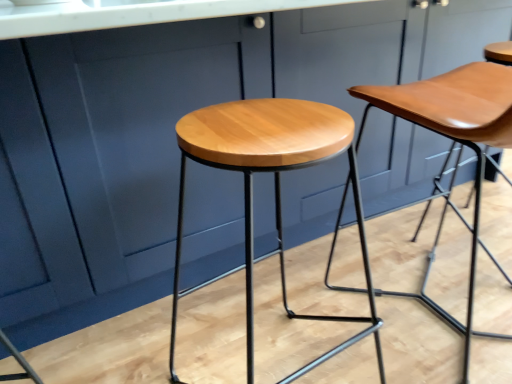
Question: In terms of height, does light brown wood stool at center, which is counted as the second stool, starting from the right, look taller or shorter compared to matte wood stool at center, the first stool viewed from the right?

Choices:
 (A) tall
 (B) short

Answer: (B)

Question: In the image, is light brown wood stool at center, which is counted as the second stool, starting from the right, positioned in front of or behind matte wood stool at center, which is counted as the 2th stool, starting from the left?

Choices:
 (A) front
 (B) behind

Answer: (A)

Question: From the image's perspective, is light brown wood stool at center, which is counted as the second stool, starting from the right, above or below matte wood stool at center, which is counted as the 2th stool, starting from the left?

Choices:
 (A) above
 (B) below

Answer: (B)

Question: Considering the positions of point (448, 81) and point (248, 369), is point (448, 81) closer or farther from the camera than point (248, 369)?

Choices:
 (A) farther
 (B) closer

Answer: (A)

Question: From a real-world perspective, is matte wood stool at center, the first stool viewed from the right, physically located above or below light brown wood stool at center, which is the first stool from left to right?

Choices:
 (A) below
 (B) above

Answer: (B)

Question: Relative to light brown wood stool at center, which is the first stool from left to right, is matte wood stool at center, which is counted as the 2th stool, starting from the left, in front or behind?

Choices:
 (A) front
 (B) behind

Answer: (B)

Question: From the image's perspective, is matte wood stool at center, which is counted as the 2th stool, starting from the left, located above or below light brown wood stool at center, which is the first stool from left to right?

Choices:
 (A) below
 (B) above

Answer: (B)